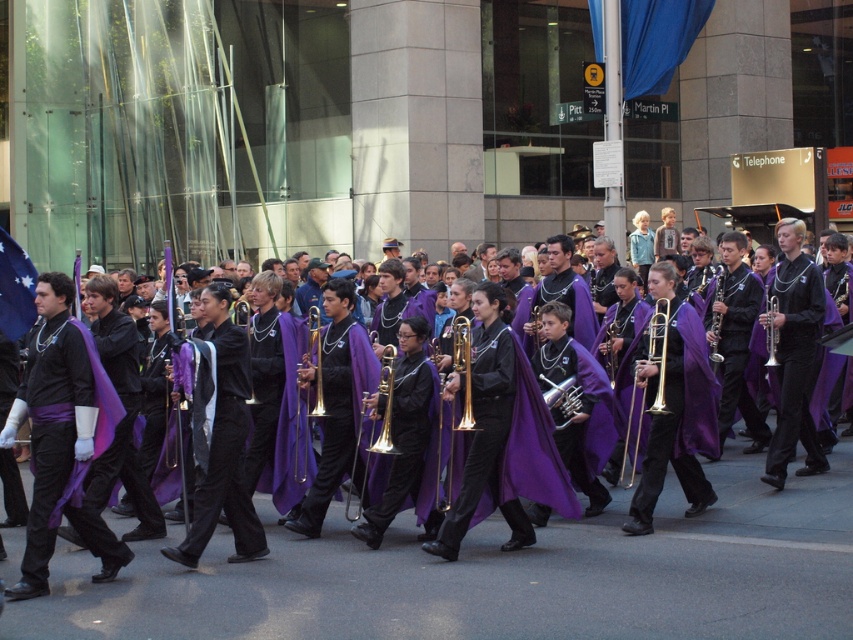
Question: Among these points, which one is nearest to the camera?

Choices:
 (A) (469, 346)
 (B) (648, 358)
 (C) (392, 401)

Answer: (A)

Question: Is gold brass trombone at center smaller than matte purple clarinet at center?

Choices:
 (A) no
 (B) yes

Answer: (B)

Question: Observing the image, what is the correct spatial positioning of black matte trumpet at center in reference to silver metallic trumpet at center?

Choices:
 (A) below
 (B) above

Answer: (A)

Question: Which of these objects is positioned farthest from the matte purple clarinet at center?

Choices:
 (A) shiny gold trumpet at center
 (B) black matte trumpet at center

Answer: (A)

Question: Does gold brass trumpet at center have a smaller size compared to silver metallic trumpet at center?

Choices:
 (A) yes
 (B) no

Answer: (B)

Question: Which object is farther from the camera taking this photo?

Choices:
 (A) blue fabric flag at left
 (B) shiny gold trumpet at center
 (C) purple matte cape at center
 (D) gold brass trumpet at center

Answer: (D)